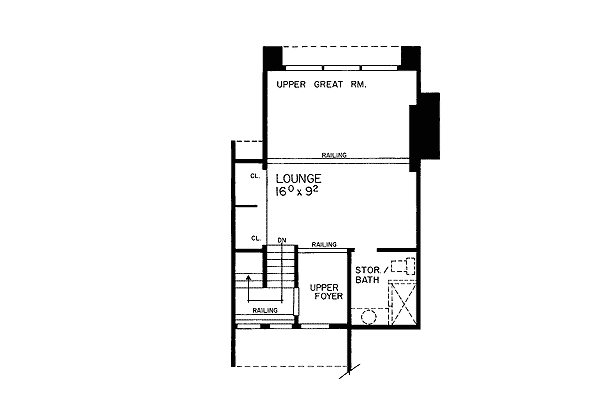
Locate an element on the screen. The image size is (600, 403). rooms on a blueprint of a house/building is located at coordinates (340, 61), (373, 135), (376, 178), (251, 220), (318, 272), (284, 307), (290, 349), (368, 295), (248, 187), (249, 260).